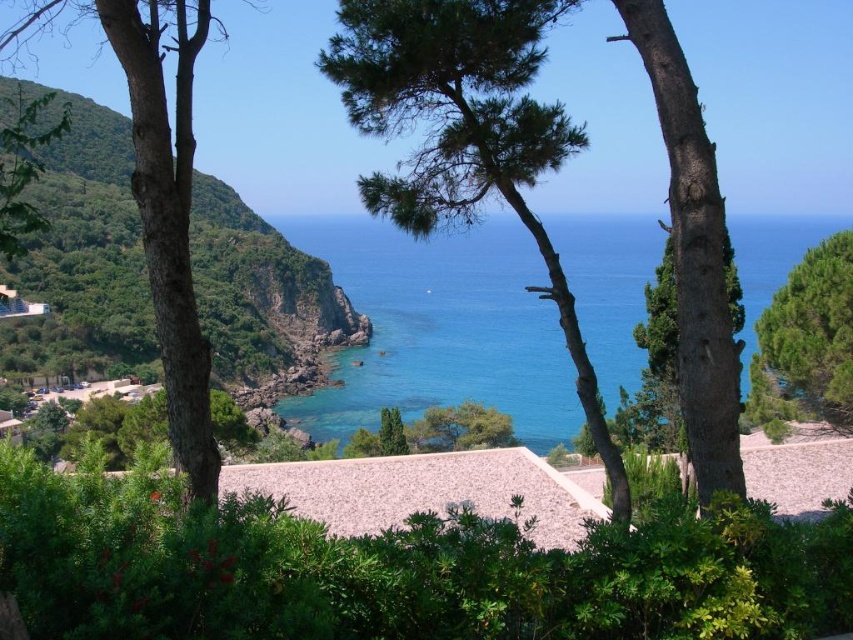
You are standing on the beach and see the smooth brown tree trunk at left and the green textured tree at right. Which tree is taller?

The smooth brown tree trunk at left is taller than the green textured tree at right.